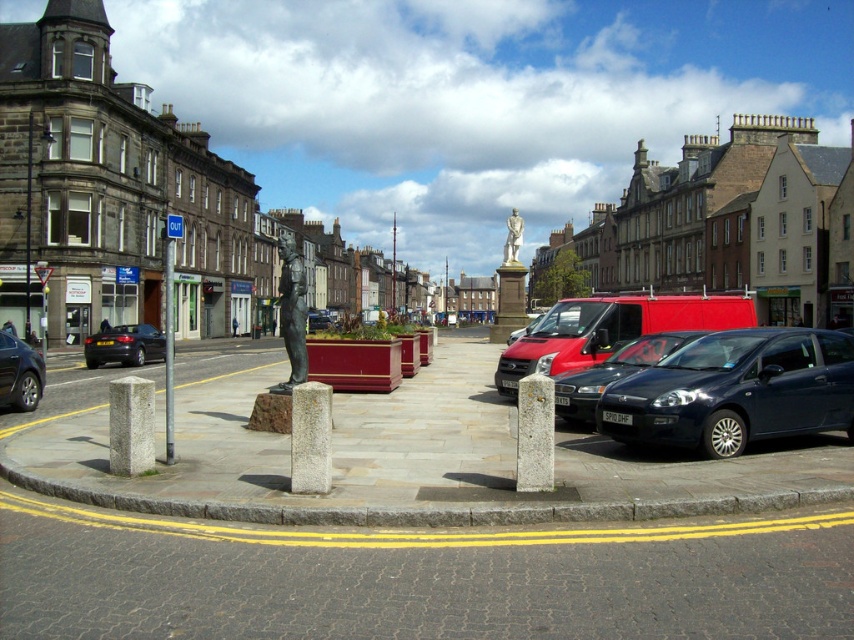
Does granite post at center come behind shiny black sedan at lower left?

No.

Locate an element on the screen. This screenshot has height=640, width=854. granite post at center is located at coordinates (535, 433).

This screenshot has width=854, height=640. Find the location of `granite post at center`. granite post at center is located at coordinates (535, 433).

The height and width of the screenshot is (640, 854). What are the coordinates of `granite post at center` in the screenshot? It's located at (535, 433).

Can you confirm if gray stone pillar at center is taller than bronze statue at center?

No, gray stone pillar at center is not taller than bronze statue at center.

Is gray stone pillar at center to the left of bronze statue at center from the viewer's perspective?

Incorrect, gray stone pillar at center is not on the left side of bronze statue at center.

Where is `gray stone pillar at center`? gray stone pillar at center is located at coordinates (309, 436).

Does gray stone pillar at center have a smaller size compared to white marble statue at center?

Indeed, gray stone pillar at center has a smaller size compared to white marble statue at center.

Is point (313, 464) positioned after point (518, 243)?

No, it is in front of (518, 243).

Locate an element on the screen. The height and width of the screenshot is (640, 854). gray stone pillar at center is located at coordinates (309, 436).